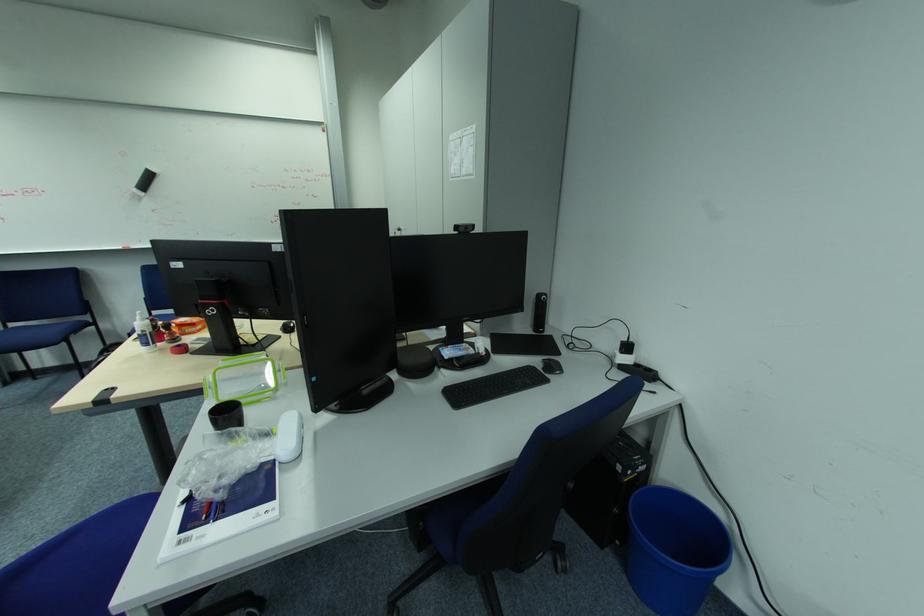
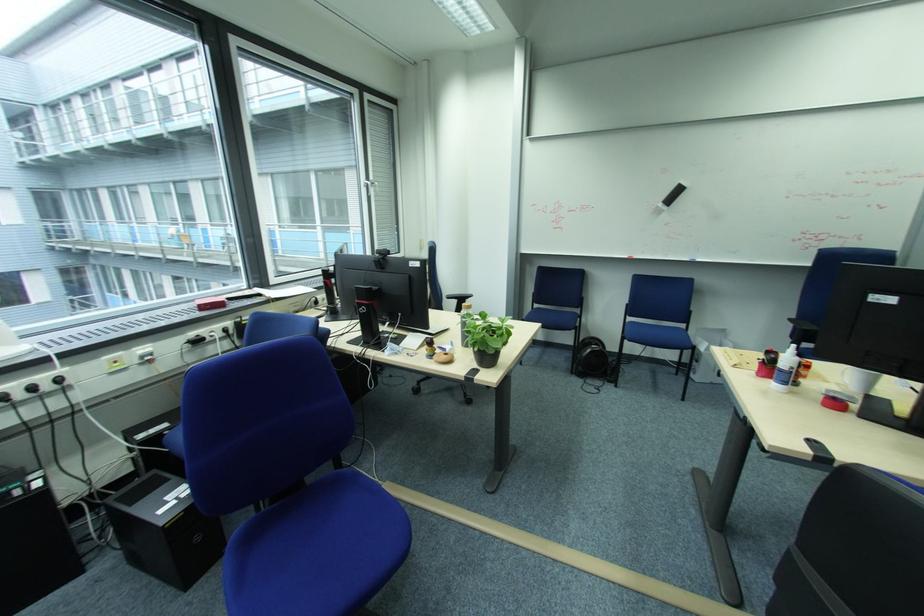
Locate, in the second image, the point that corresponds to (x=152, y=349) in the first image.

(784, 387)